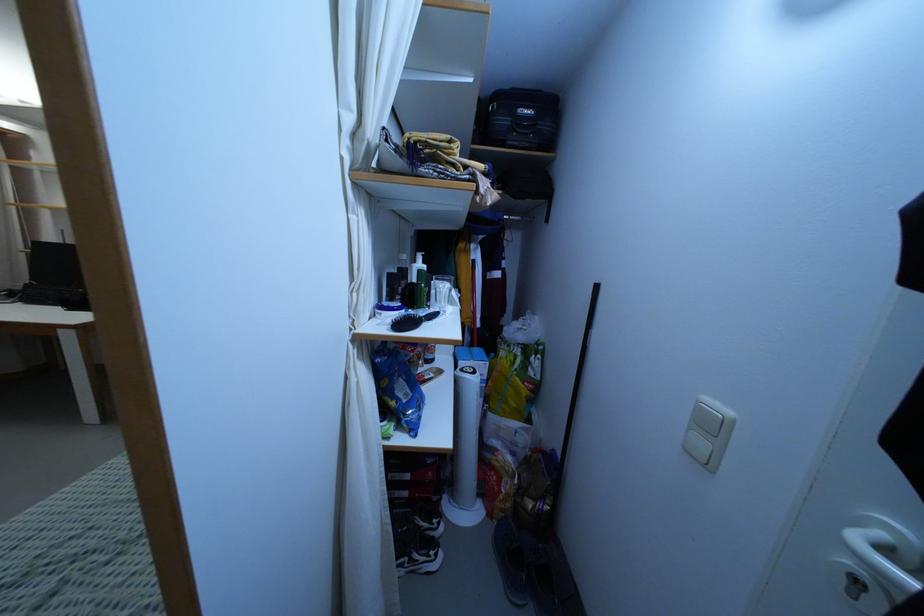
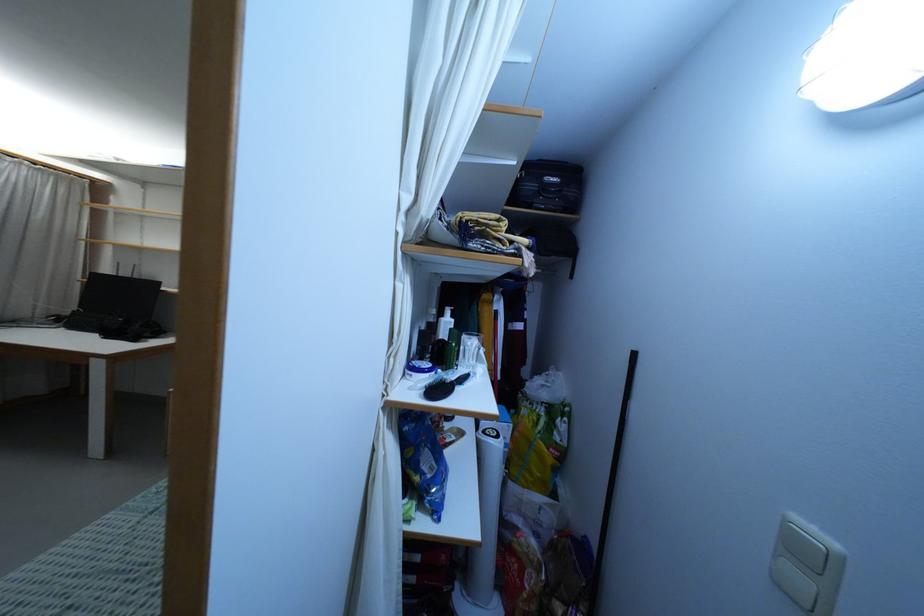
The point at (428, 306) is marked in the first image. Where is the corresponding point in the second image?

(456, 365)